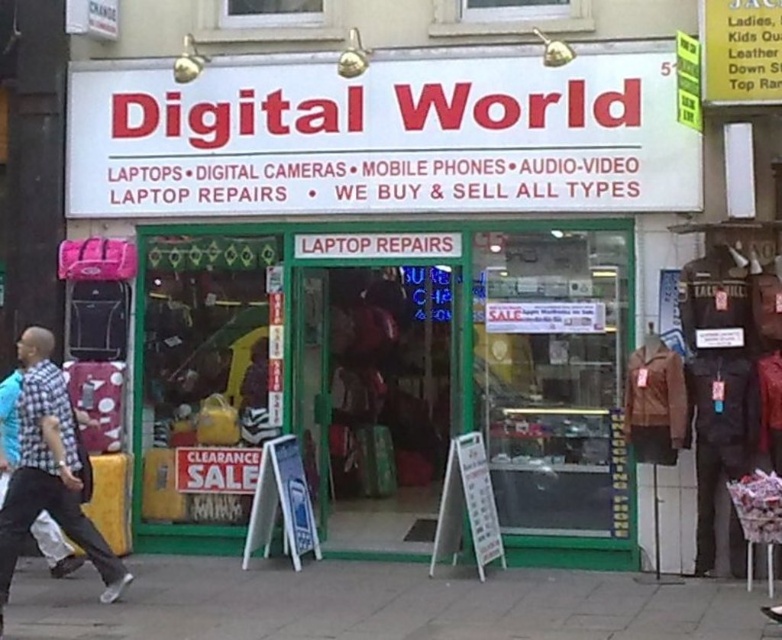
Question: Is gray concrete pavement at lower center thinner than checkered fabric shirt at left?

Choices:
 (A) yes
 (B) no

Answer: (B)

Question: Estimate the real-world distances between objects in this image. Which object is closer to the checkered fabric shirt at left?

Choices:
 (A) gray concrete pavement at lower center
 (B) leather jacket at center

Answer: (B)

Question: Is leather jacket at center to the left of gray concrete pavement at lower center from the viewer's perspective?

Choices:
 (A) no
 (B) yes

Answer: (B)

Question: Is gray concrete pavement at lower center below checkered fabric shirt at left?

Choices:
 (A) yes
 (B) no

Answer: (A)

Question: Among these objects, which one is farthest from the camera?

Choices:
 (A) leather jacket at center
 (B) gray concrete pavement at lower center
 (C) checkered fabric shirt at left

Answer: (A)

Question: Among these points, which one is farthest from the camera?

Choices:
 (A) (372, 432)
 (B) (282, 566)

Answer: (A)